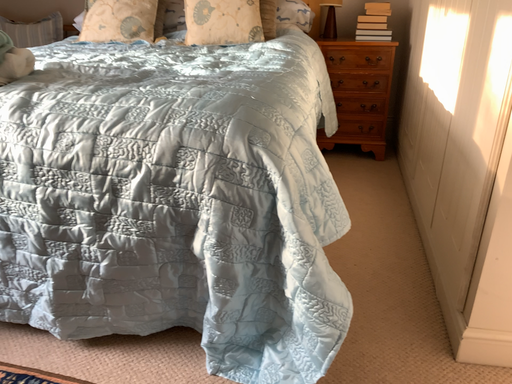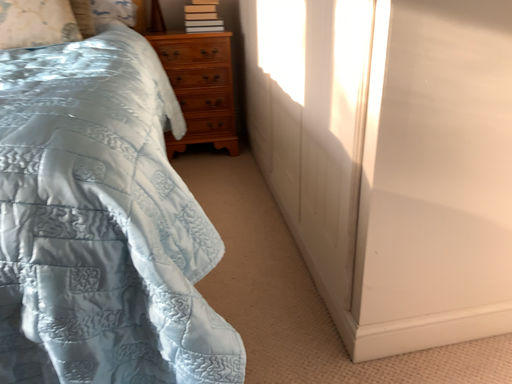
Question: How did the camera likely rotate when shooting the video?

Choices:
 (A) rotated left
 (B) rotated right

Answer: (B)